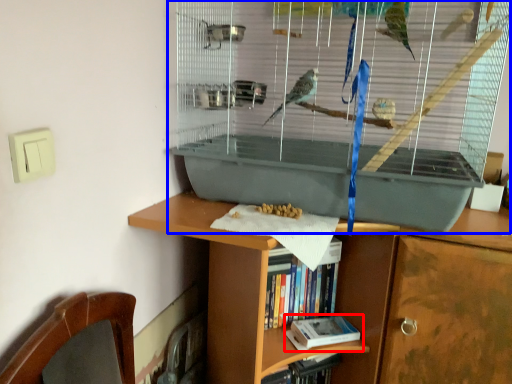
Question: Which of the following is the farthest to the observer, book (highlighted by a red box) or bird cage (highlighted by a blue box)?

Choices:
 (A) book
 (B) bird cage

Answer: (A)